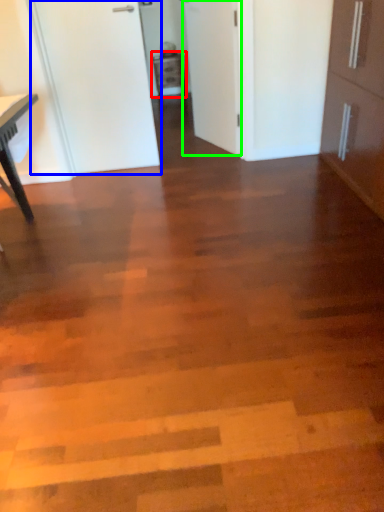
Question: Which object is the closest to the cabinetry (highlighted by a red box)? Choose among these: door (highlighted by a blue box) or door (highlighted by a green box).

Choices:
 (A) door
 (B) door

Answer: (B)